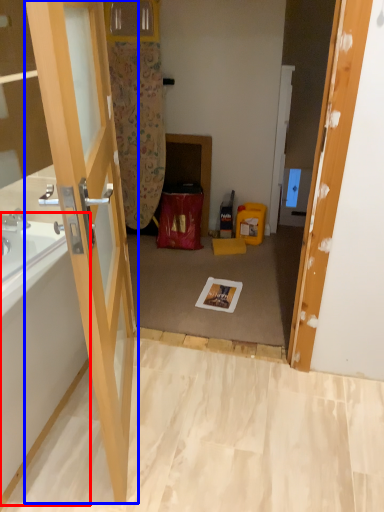
Question: Which point is closer to the camera, bath (highlighted by a red box) or door (highlighted by a blue box)?

Choices:
 (A) bath
 (B) door

Answer: (B)